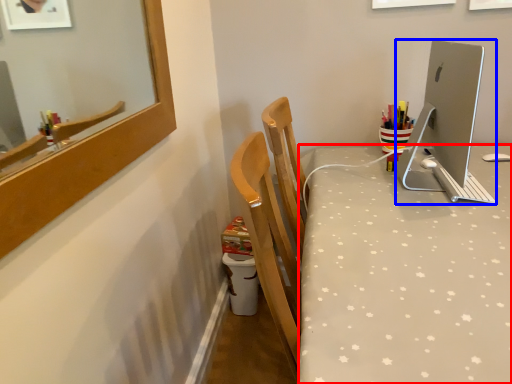
Question: Which object appears farthest to the camera in this image, desk (highlighted by a red box) or desktop computer (highlighted by a blue box)?

Choices:
 (A) desk
 (B) desktop computer

Answer: (B)